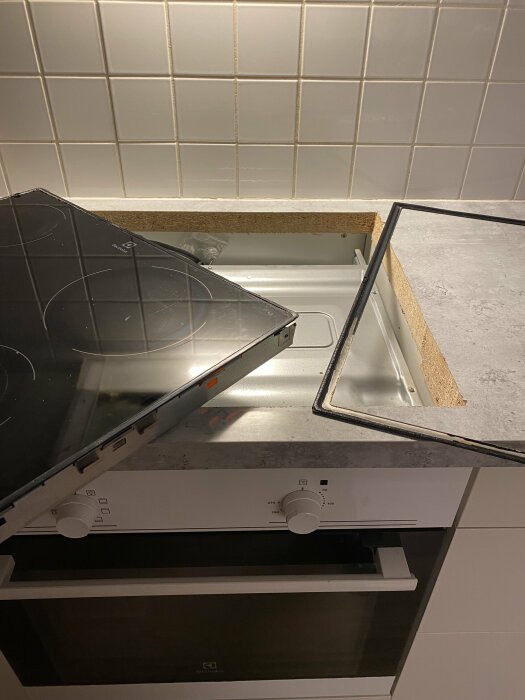
You are a GUI agent. You are given a task and a screenshot of the screen. Output one action in this format:
    pyautogui.click(x=<x>, y=<y>)
    Task: Click on the white oven
    Image resolution: width=525 pixels, height=700 pixels.
    Given the screenshot: What is the action you would take?
    pyautogui.click(x=420, y=511)